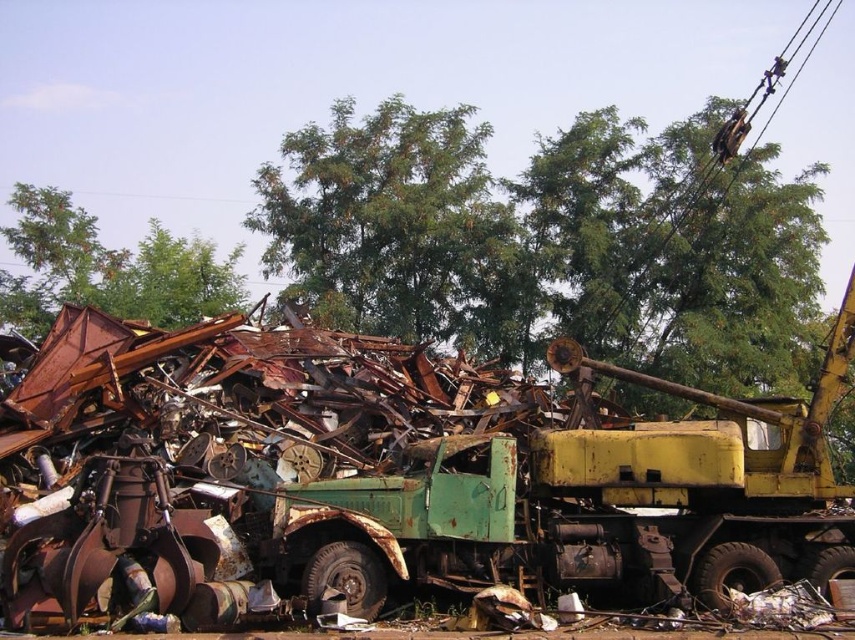
Question: Estimate the real-world distances between objects in this image. Which object is farther from the green leafy tree at upper center?

Choices:
 (A) green leafy tree at upper left
 (B) rusty metal tow truck at center

Answer: (B)

Question: Which point is farther to the camera?

Choices:
 (A) green leafy tree at upper center
 (B) rusty metal tow truck at center
 (C) green leafy tree at upper left

Answer: (C)

Question: Is rusty metal tow truck at center further to the viewer compared to green leafy tree at upper left?

Choices:
 (A) yes
 (B) no

Answer: (B)

Question: Is the position of green leafy tree at upper center more distant than that of green leafy tree at upper left?

Choices:
 (A) no
 (B) yes

Answer: (A)

Question: Estimate the real-world distances between objects in this image. Which object is farther from the rusty metal tow truck at center?

Choices:
 (A) green leafy tree at upper center
 (B) green leafy tree at upper left

Answer: (B)

Question: Is rusty metal tow truck at center positioned at the back of green leafy tree at upper left?

Choices:
 (A) no
 (B) yes

Answer: (A)